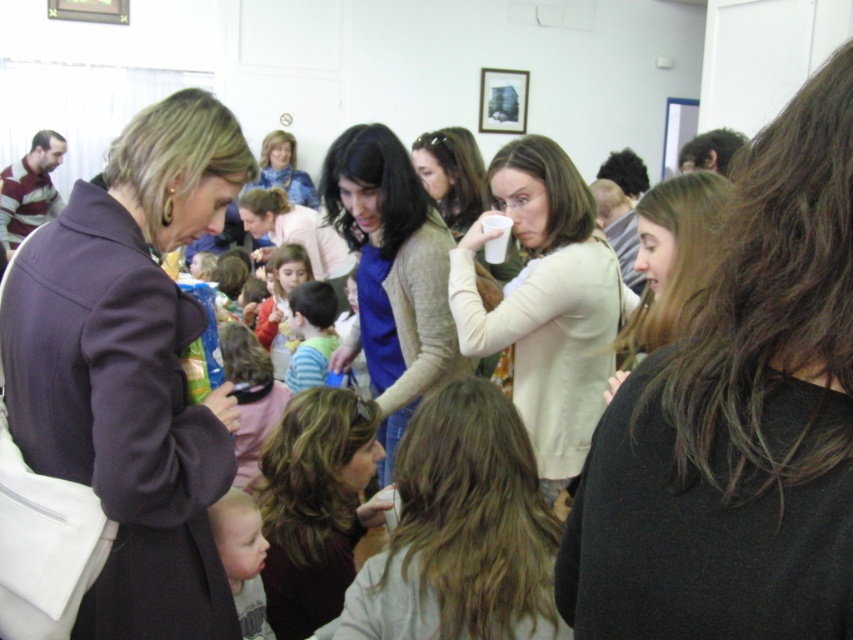
Between dark brown hair at upper right and red sweater at center, which one is positioned higher?

Positioned higher is red sweater at center.

Can you confirm if dark brown hair at upper right is positioned below red sweater at center?

Indeed, dark brown hair at upper right is positioned under red sweater at center.

Does point (643, 605) come in front of point (293, 262)?

Yes, it is.

Identify the location of dark brown hair at upper right. (737, 419).

Is point (592, 339) positioned in front of point (277, 292)?

Yes, point (592, 339) is in front of point (277, 292).

Who is shorter, light beige sweater at center or red sweater at center?

red sweater at center

The height and width of the screenshot is (640, 853). Describe the element at coordinates (546, 304) in the screenshot. I see `light beige sweater at center` at that location.

I want to click on light beige sweater at center, so click(x=546, y=304).

Between striped cotton shirt at center and red sweater at center, which one has more height?

red sweater at center

Which is behind, point (312, 344) or point (264, 333)?

The point (264, 333) is more distant.

Is point (312, 353) closer to camera compared to point (303, 276)?

That is True.

Identify the location of striped cotton shirt at center. This screenshot has width=853, height=640. (310, 333).